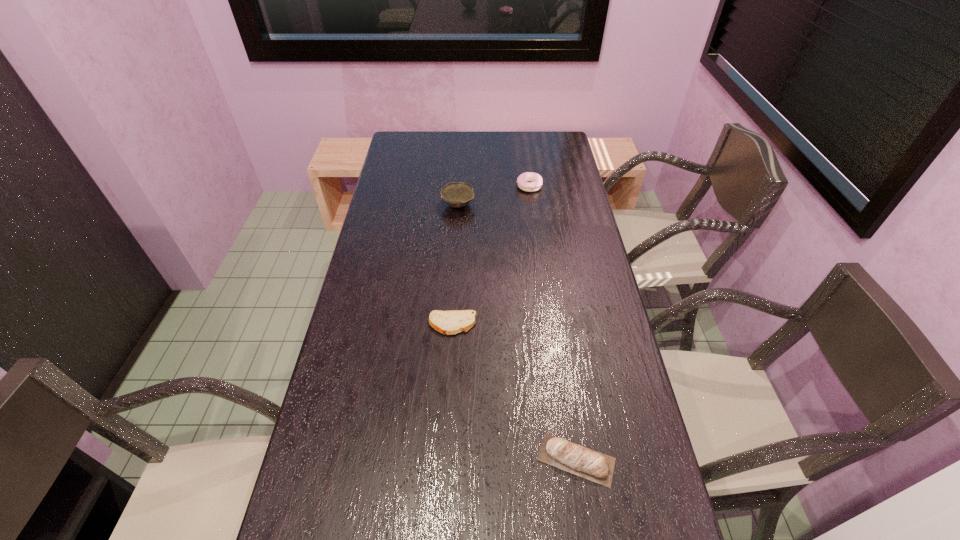
Locate an element on the screen. Image resolution: width=960 pixels, height=540 pixels. the tallest object is located at coordinates (456, 194).

The width and height of the screenshot is (960, 540). I want to click on bowl, so click(x=456, y=194).

I want to click on doughnut, so click(523, 180).

Find the location of a particular element. the taller pita bread is located at coordinates (584, 462).

At what (x,y) coordinates should I click in order to perform the action: click on the nearer pita bread. Please return your answer as a coordinate pair (x, y). Looking at the image, I should click on (584, 462).

Where is `the third farthest object`? The height and width of the screenshot is (540, 960). the third farthest object is located at coordinates (451, 322).

Where is `the left pita bread`? This screenshot has width=960, height=540. the left pita bread is located at coordinates (451, 322).

Where is `vacant space located on the back of the second farthest object`? The width and height of the screenshot is (960, 540). vacant space located on the back of the second farthest object is located at coordinates (461, 156).

The width and height of the screenshot is (960, 540). What are the coordinates of `vacant space situated on the front of the doughnut` in the screenshot? It's located at (534, 222).

You are a GUI agent. You are given a task and a screenshot of the screen. Output one action in this format:
    pyautogui.click(x=<x>, y=<y>)
    Task: Click on the vacant area situated 0.310m on the left of the right pita bread
    This screenshot has width=960, height=540.
    Given the screenshot: What is the action you would take?
    click(399, 460)